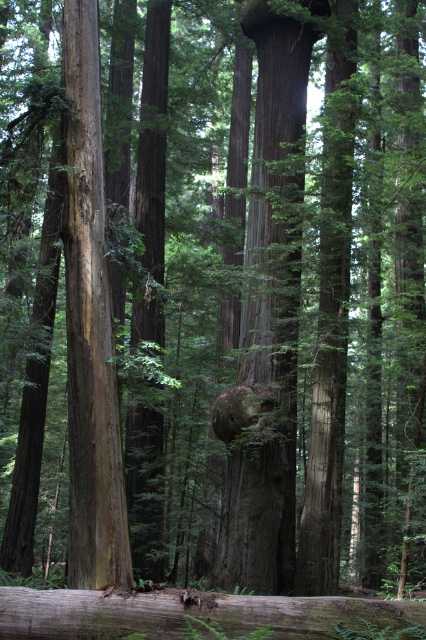
Based on the photo, does smooth brown tree trunk at left come in front of grayish-brown wood log at lower center?

That is False.

Find the location of `smooth brown tree trunk at left`. smooth brown tree trunk at left is located at coordinates (89, 326).

Does smooth brown tree trunk at center have a lesser width compared to grayish-brown wood log at lower center?

Correct, smooth brown tree trunk at center's width is less than grayish-brown wood log at lower center's.

Between point (273, 408) and point (193, 595), which one is positioned in front?

Point (193, 595) is more forward.

Between point (250, 529) and point (394, 611), which one is positioned behind?

The point (250, 529) is behind.

At what (x,y) coordinates should I click in order to perform the action: click on smooth brown tree trunk at center. Please return your answer as a coordinate pair (x, y). Image resolution: width=426 pixels, height=640 pixels. Looking at the image, I should click on (270, 310).

Is smooth brown tree trunk at center smaller than smooth brown tree trunk at left?

Yes.

Does point (290, 385) lie behind point (94, 291)?

Yes, it is behind point (94, 291).

Where is `smooth brown tree trunk at center`? smooth brown tree trunk at center is located at coordinates (270, 310).